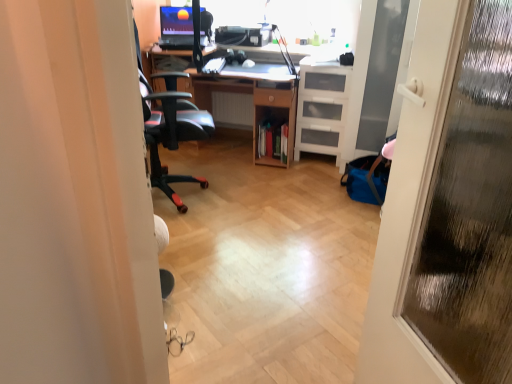
Question: Can you confirm if transparent glass door at right is bigger than wooden desk at center?

Choices:
 (A) no
 (B) yes

Answer: (A)

Question: Is the position of transparent glass door at right less distant than that of wooden desk at center?

Choices:
 (A) yes
 (B) no

Answer: (A)

Question: Considering the relative positions of transparent glass door at right and wooden desk at center in the image provided, is transparent glass door at right to the right of wooden desk at center from the viewer's perspective?

Choices:
 (A) no
 (B) yes

Answer: (B)

Question: Is transparent glass door at right not inside wooden desk at center?

Choices:
 (A) yes
 (B) no

Answer: (A)

Question: From the image's perspective, is transparent glass door at right below wooden desk at center?

Choices:
 (A) no
 (B) yes

Answer: (B)

Question: Is transparent glass door at right shorter than wooden desk at center?

Choices:
 (A) yes
 (B) no

Answer: (B)

Question: Is white plastic radiator at center looking in the opposite direction of transparent glass screen door at right?

Choices:
 (A) no
 (B) yes

Answer: (A)

Question: Does white plastic radiator at center have a lesser height compared to transparent glass screen door at right?

Choices:
 (A) yes
 (B) no

Answer: (A)

Question: From a real-world perspective, is white plastic radiator at center physically below transparent glass screen door at right?

Choices:
 (A) no
 (B) yes

Answer: (B)

Question: From the image's perspective, does white plastic radiator at center appear lower than transparent glass screen door at right?

Choices:
 (A) yes
 (B) no

Answer: (B)

Question: Is the depth of white plastic radiator at center greater than that of transparent glass screen door at right?

Choices:
 (A) no
 (B) yes

Answer: (B)

Question: Is white plastic radiator at center bigger than transparent glass screen door at right?

Choices:
 (A) yes
 (B) no

Answer: (B)

Question: Would you consider transparent glass screen door at right to be distant from matte black monitor at upper center?

Choices:
 (A) no
 (B) yes

Answer: (B)